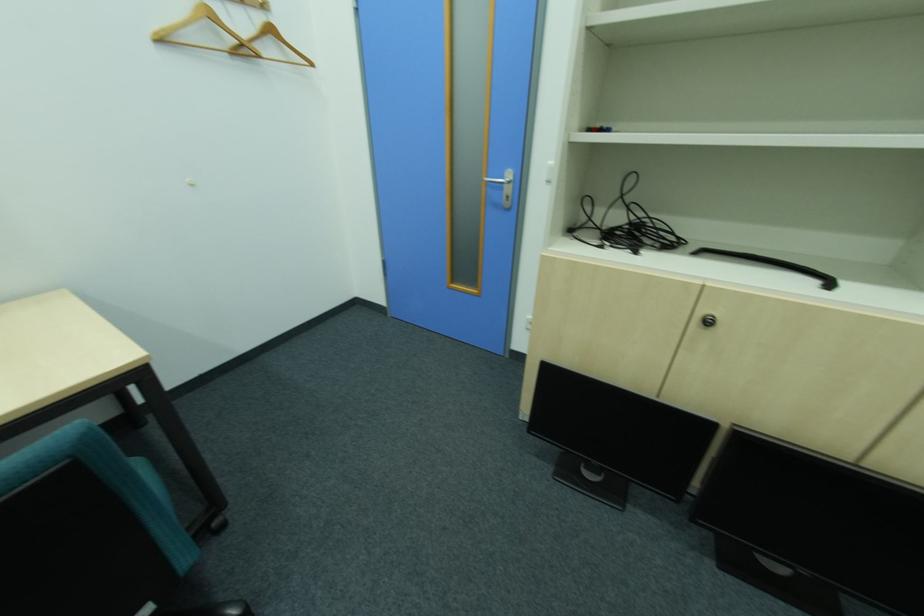
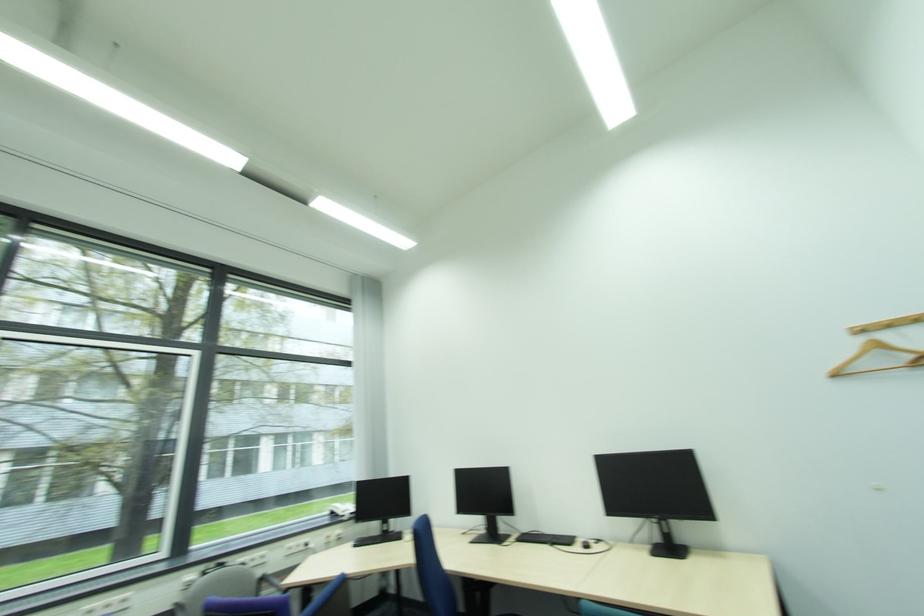
How did the camera likely rotate?

The rotation direction of the camera is left-up.